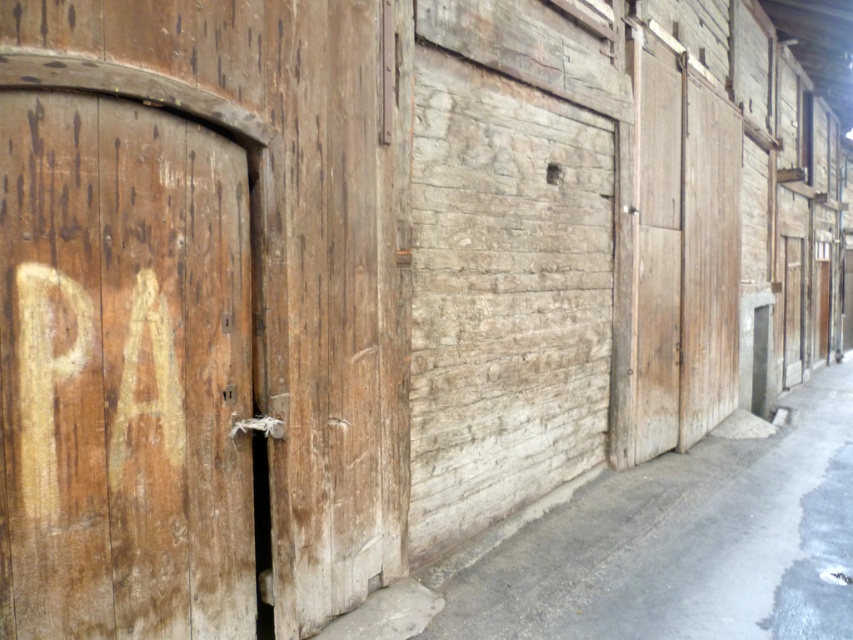
Question: Which of the following is the farthest from the observer?

Choices:
 (A) wooden door at center
 (B) wooden door at left

Answer: (A)

Question: Among these points, which one is farthest from the camera?

Choices:
 (A) (717, 172)
 (B) (340, 406)

Answer: (A)

Question: Among these objects, which one is nearest to the camera?

Choices:
 (A) wooden door at center
 (B) wooden door at left

Answer: (B)

Question: Can you confirm if wooden door at left is wider than wooden door at center?

Choices:
 (A) no
 (B) yes

Answer: (A)

Question: Can you confirm if wooden door at left is positioned to the right of wooden door at center?

Choices:
 (A) no
 (B) yes

Answer: (A)

Question: Is wooden door at left closer to camera compared to wooden door at center?

Choices:
 (A) yes
 (B) no

Answer: (A)